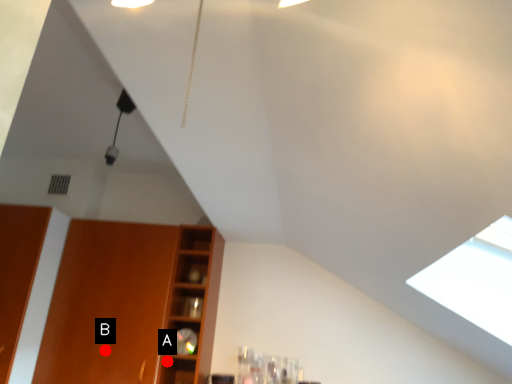
Question: Two points are circled on the image, labeled by A and B beside each circle. Which point is closer to the camera?

Choices:
 (A) A is closer
 (B) B is closer

Answer: (B)